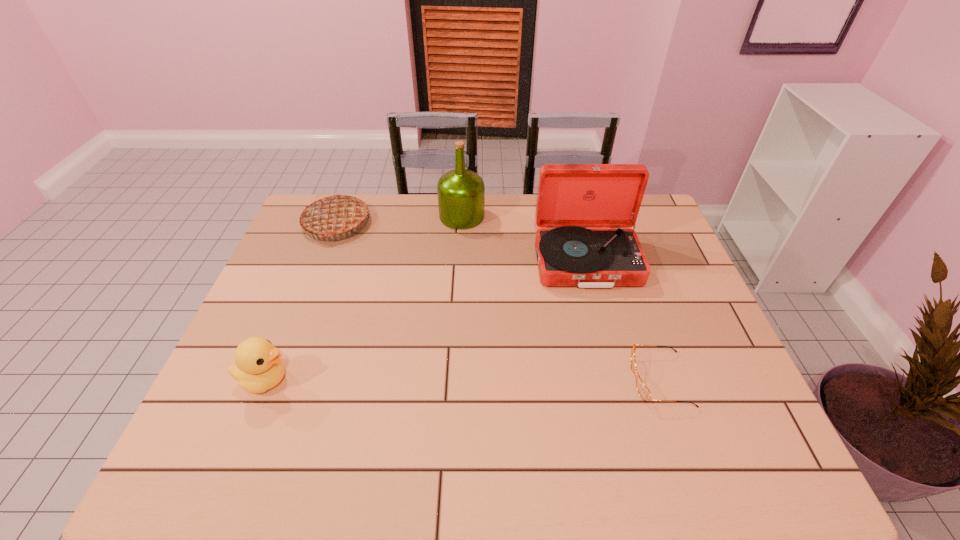
I want to click on olive oil, so click(461, 193).

This screenshot has width=960, height=540. In order to click on phonograph_record in this screenshot , I will do `click(584, 211)`.

Find the location of `the third tallest object`. the third tallest object is located at coordinates (335, 214).

This screenshot has height=540, width=960. In order to click on duck in this screenshot , I will do `click(258, 367)`.

I want to click on spectacles, so [644, 392].

The width and height of the screenshot is (960, 540). I want to click on free location located on the front of the third object from right to left, so click(x=460, y=248).

Locate an element on the screen. This screenshot has width=960, height=540. free region located 0.080m on the front-facing side of the phonograph_record is located at coordinates (600, 314).

Identify the location of free space located 0.380m on the right of the third shortest object. This screenshot has height=540, width=960. (483, 223).

Where is `free spot located 0.190m on the face of the fourth tallest object`? The image size is (960, 540). free spot located 0.190m on the face of the fourth tallest object is located at coordinates (373, 380).

This screenshot has width=960, height=540. I want to click on vacant space located 0.240m on the front-facing side of the shortest object, so click(532, 380).